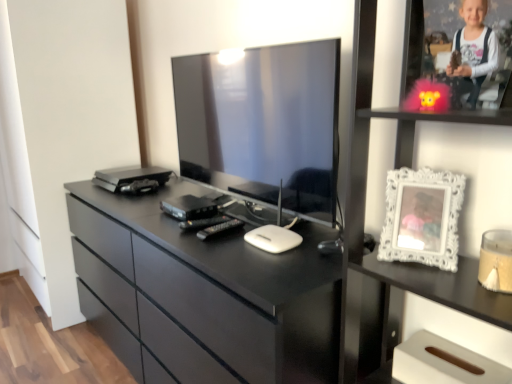
What is the approximate height of satin black television at center?

satin black television at center is 24.08 inches tall.

Where is `black glossy chest of drawers at center`? black glossy chest of drawers at center is located at coordinates (205, 293).

Describe the element at coordinates (439, 116) in the screenshot. I see `white glossy frame at upper right` at that location.

At what (x,y) coordinates should I click in order to perform the action: click on satin black device at center. Please return your answer as a coordinate pair (x, y). This screenshot has width=512, height=384. Looking at the image, I should click on (189, 207).

Identify the location of white ornate frame at right. click(422, 217).

Is satin black device at center inside the boundaries of white glossy frame at upper right, or outside?

satin black device at center is not inside white glossy frame at upper right, it's outside.

From the image's perspective, between satin black device at center and white glossy frame at upper right, which one is located above?

white glossy frame at upper right, from the image's perspective.

Does satin black device at center have a greater height compared to white glossy frame at upper right?

Incorrect, the height of satin black device at center is not larger of that of white glossy frame at upper right.

Can you tell me how much white glossy picture frame at upper right and satin black television at center differ in facing direction?

The facing directions of white glossy picture frame at upper right and satin black television at center are 1.45 degrees apart.

Can satin black television at center be found inside white glossy picture frame at upper right?

No, satin black television at center is not a part of white glossy picture frame at upper right.

Looking at their sizes, would you say white glossy picture frame at upper right is wider or thinner than satin black television at center?

white glossy picture frame at upper right is wider than satin black television at center.

Considering the positions of points (462, 273) and (193, 160), is point (462, 273) farther from camera compared to point (193, 160)?

No, it is in front of (193, 160).

How different are the orientations of black glossy chest of drawers at center and white glossy picture frame at upper right in degrees?

4.88e-05 degrees.

Is black glossy chest of drawers at center wider than white glossy picture frame at upper right?

Yes.

Is black glossy chest of drawers at center facing towards white glossy picture frame at upper right?

No, black glossy chest of drawers at center is not turned towards white glossy picture frame at upper right.

Is there a large distance between satin black television at center and white glossy frame at upper right?

No, satin black television at center is in close proximity to white glossy frame at upper right.

Considering the sizes of satin black television at center and white glossy frame at upper right in the image, is satin black television at center wider or thinner than white glossy frame at upper right?

satin black television at center is thinner than white glossy frame at upper right.

Does satin black television at center have a larger size compared to white glossy frame at upper right?

Yes.

Is the position of satin black television at center less distant than that of white glossy frame at upper right?

No, it is not.

Does black glossy chest of drawers at center have a lesser height compared to satin black device at center?

No, black glossy chest of drawers at center is not shorter than satin black device at center.

Between black glossy chest of drawers at center and satin black device at center, which one appears on the right side from the viewer's perspective?

satin black device at center.

Considering the sizes of objects black glossy chest of drawers at center and satin black device at center in the image provided, who is thinner, black glossy chest of drawers at center or satin black device at center?

satin black device at center is thinner.

Which of these two, black glossy chest of drawers at center or satin black device at center, is bigger?

Bigger between the two is black glossy chest of drawers at center.

Considering the positions of objects satin black device at center and white glossy picture frame at upper right in the image provided, who is more to the right, satin black device at center or white glossy picture frame at upper right?

white glossy picture frame at upper right is more to the right.

Which object is closer to the camera taking this photo, satin black device at center or white glossy picture frame at upper right?

white glossy picture frame at upper right is closer to the camera.

Which of these two, satin black device at center or white glossy picture frame at upper right, is thinner?

satin black device at center.

Which is behind, point (469, 117) or point (184, 215)?

The point (184, 215) is behind.

This screenshot has height=384, width=512. What are the coordinates of `gadget on the left of white glossy frame at upper right` in the screenshot? It's located at (189, 207).

From their relative heights in the image, would you say white glossy frame at upper right is taller or shorter than satin black device at center?

white glossy frame at upper right is taller than satin black device at center.

You are a GUI agent. You are given a task and a screenshot of the screen. Output one action in this format:
    pyautogui.click(x=<x>, y=<y>)
    Task: Click on the shelf on the right of satin black device at center
    This screenshot has height=384, width=512.
    Given the screenshot: What is the action you would take?
    pyautogui.click(x=439, y=116)

You are a GUI agent. You are given a task and a screenshot of the screen. Output one action in this format:
    pyautogui.click(x=<x>, y=<y>)
    Task: Click on the tv cabinet below the satin black television at center (from the image's perspective)
    
    Given the screenshot: What is the action you would take?
    click(417, 264)

Which object lies nearer to the anchor point white ornate frame at right, white glossy picture frame at upper right or satin black television at center?

white glossy picture frame at upper right is closer to white ornate frame at right.

When comparing their distances from satin black television at center, does white glossy picture frame at upper right or white ornate frame at right seem further?

white ornate frame at right lies further to satin black television at center than the other object.

Which object lies further to the anchor point black glossy chest of drawers at center, satin black device at center or white glossy frame at upper right?

white glossy frame at upper right lies further to black glossy chest of drawers at center than the other object.

When comparing their distances from white glossy frame at upper right, does white glossy picture frame at upper right or black glossy chest of drawers at center seem closer?

white glossy picture frame at upper right lies closer to white glossy frame at upper right than the other object.

Looking at the image, which one is located closer to white glossy frame at upper right, white ornate frame at right or satin black television at center?

white ornate frame at right.

When comparing their distances from satin black television at center, does white ornate frame at right or white glossy frame at upper right seem closer?

white glossy frame at upper right is closer to satin black television at center.

Considering their positions, is white ornate frame at right positioned closer to white glossy picture frame at upper right than satin black television at center?

white ornate frame at right is closer to white glossy picture frame at upper right.

From the image, which object appears to be farther from satin black device at center, white glossy frame at upper right or white glossy picture frame at upper right?

Among the two, white glossy frame at upper right is located further to satin black device at center.

At what (x,y) coordinates should I click in order to perform the action: click on the chest of drawers positioned between white glossy picture frame at upper right and satin black device at center from near to far. Please return your answer as a coordinate pair (x, y). Image resolution: width=512 pixels, height=384 pixels. Looking at the image, I should click on (205, 293).

This screenshot has width=512, height=384. I want to click on shelf between white glossy picture frame at upper right and satin black device at center in the front-back direction, so click(439, 116).

The width and height of the screenshot is (512, 384). I want to click on television positioned between white glossy picture frame at upper right and satin black device at center from near to far, so click(263, 124).

Where is `television between satin black device at center and white glossy frame at upper right from left to right`? The height and width of the screenshot is (384, 512). television between satin black device at center and white glossy frame at upper right from left to right is located at coordinates (263, 124).